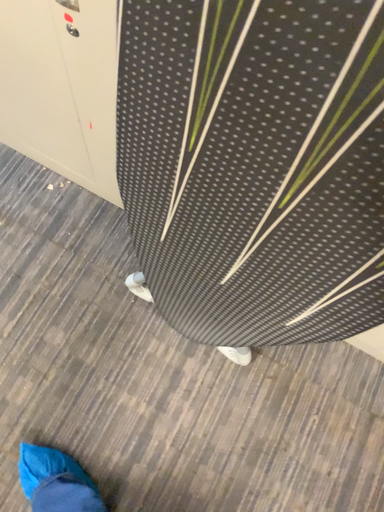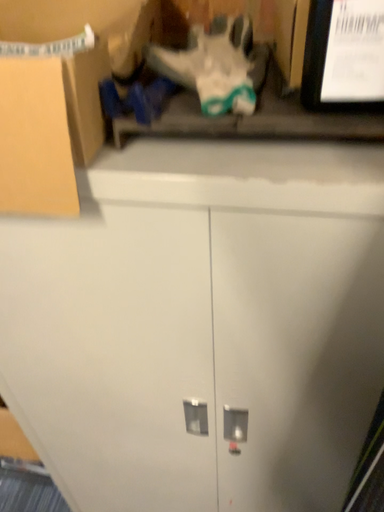
Question: Which way did the camera rotate in the video?

Choices:
 (A) rotated upward
 (B) rotated downward

Answer: (A)